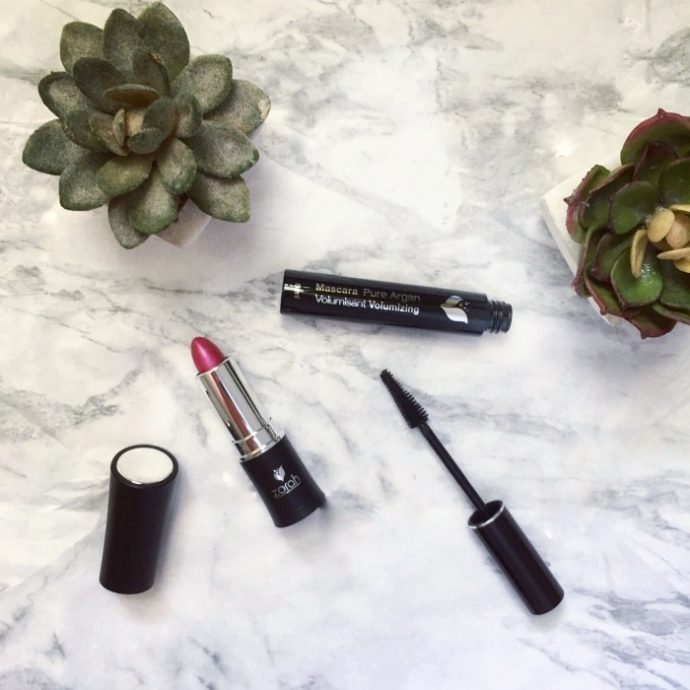
The height and width of the screenshot is (690, 690). I want to click on dark green fake leaf, so click(163, 61).